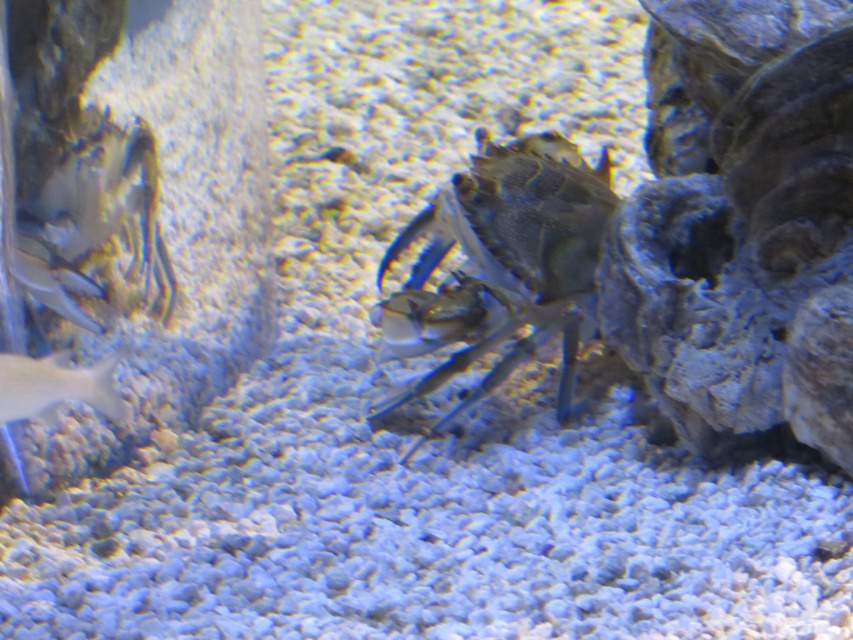
Between shiny metallic crab at center and shiny silver fish at lower left, which one appears on the left side from the viewer's perspective?

shiny silver fish at lower left is more to the left.

Is shiny metallic crab at center behind shiny silver fish at lower left?

Yes, it is behind shiny silver fish at lower left.

Find the location of a particular element. This screenshot has height=640, width=853. shiny metallic crab at center is located at coordinates (502, 266).

Identify the location of shiny metallic crab at center. (502, 266).